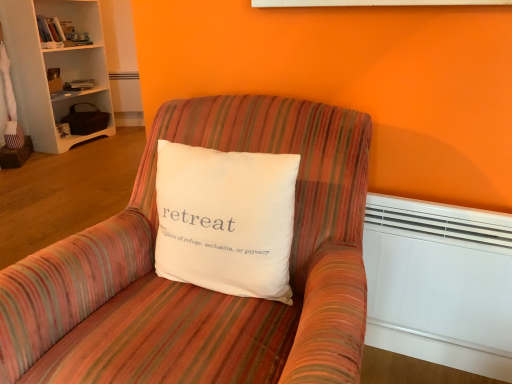
Identify the location of white cotton pillow at center. (226, 219).

Find the location of a particular element. striped fabric chair at center is located at coordinates (198, 287).

Locate an element on the screen. white cotton pillow at center is located at coordinates (226, 219).

From the image's perspective, would you say white cotton pillow at center is positioned over striped fabric chair at center?

Yes, from the image's perspective, white cotton pillow at center is over striped fabric chair at center.

Can you confirm if white cotton pillow at center is thinner than striped fabric chair at center?

Yes, white cotton pillow at center is thinner than striped fabric chair at center.

From the picture: Is striped fabric chair at center a part of white cotton pillow at center?

Actually, striped fabric chair at center is outside white cotton pillow at center.

Is white wood bookcase at upper left facing towards striped fabric chair at center?

No.

Considering the sizes of white wood bookcase at upper left and striped fabric chair at center in the image, is white wood bookcase at upper left bigger or smaller than striped fabric chair at center?

Considering their sizes, white wood bookcase at upper left takes up less space than striped fabric chair at center.

Is white wood bookcase at upper left beside striped fabric chair at center?

No, white wood bookcase at upper left is not with striped fabric chair at center.

From the image's perspective, which one is positioned higher, white wood bookcase at upper left or striped fabric chair at center?

white wood bookcase at upper left appears higher in the image.

From a real-world perspective, does white cotton pillow at center stand above white plastic heater at lower right?

Indeed, from a real-world perspective, white cotton pillow at center stands above white plastic heater at lower right.

From the picture: Is white cotton pillow at center at the left side of white plastic heater at lower right?

Indeed, white cotton pillow at center is positioned on the left side of white plastic heater at lower right.

From the image's perspective, is white cotton pillow at center over white plastic heater at lower right?

Yes, from the image's perspective, white cotton pillow at center is above white plastic heater at lower right.

Which object is thinner, striped fabric chair at center or white wood bookcase at upper left?

With smaller width is white wood bookcase at upper left.

Consider the image. Would you consider striped fabric chair at center to be distant from white wood bookcase at upper left?

Yes, striped fabric chair at center and white wood bookcase at upper left are quite far apart.

Does striped fabric chair at center have a larger size compared to white wood bookcase at upper left?

Indeed, striped fabric chair at center has a larger size compared to white wood bookcase at upper left.

Is striped fabric chair at center oriented towards white wood bookcase at upper left?

No, striped fabric chair at center does not turn towards white wood bookcase at upper left.

Between white plastic heater at lower right and striped fabric chair at center, which one has larger size?

With larger size is striped fabric chair at center.

Which of these two, white plastic heater at lower right or striped fabric chair at center, stands shorter?

white plastic heater at lower right is shorter.

From the image's perspective, relative to striped fabric chair at center, is white plastic heater at lower right above or below?

white plastic heater at lower right is situated higher than striped fabric chair at center in the image.

From a real-world perspective, is white plastic heater at lower right physically located above or below striped fabric chair at center?

white plastic heater at lower right is below striped fabric chair at center.

Are white cotton pillow at center and white wood bookcase at upper left beside each other?

No, white cotton pillow at center is not beside white wood bookcase at upper left.

Find the location of `pillow on the right of white wood bookcase at upper left`. pillow on the right of white wood bookcase at upper left is located at coordinates (226, 219).

Which object is further away from the camera taking this photo, white cotton pillow at center or white wood bookcase at upper left?

white wood bookcase at upper left.

From the image's perspective, is white cotton pillow at center above or below white wood bookcase at upper left?

From the image's perspective, white cotton pillow at center appears below white wood bookcase at upper left.

Considering the points (368, 240) and (167, 192), which point is behind, point (368, 240) or point (167, 192)?

Point (368, 240)

Can you confirm if white plastic heater at lower right is bigger than white cotton pillow at center?

No, white plastic heater at lower right is not bigger than white cotton pillow at center.

Is white plastic heater at lower right completely or partially outside of white cotton pillow at center?

Yes.

Who is taller, white plastic heater at lower right or white cotton pillow at center?

With more height is white plastic heater at lower right.

What are the coordinates of `chair to the left of white cotton pillow at center` in the screenshot? It's located at (198, 287).

In order to click on chair beneath the white wood bookcase at upper left (from a real-world perspective) in this screenshot , I will do `click(198, 287)`.

Estimate the real-world distances between objects in this image. Which object is closer to white plastic heater at lower right, striped fabric chair at center or white wood bookcase at upper left?

The object closer to white plastic heater at lower right is striped fabric chair at center.

Which object lies nearer to the anchor point white wood bookcase at upper left, white cotton pillow at center or white plastic heater at lower right?

white cotton pillow at center lies closer to white wood bookcase at upper left than the other object.

Looking at the image, which one is located closer to white wood bookcase at upper left, white plastic heater at lower right or striped fabric chair at center?

Among the two, striped fabric chair at center is located nearer to white wood bookcase at upper left.

From the image, which object appears to be farther from striped fabric chair at center, white cotton pillow at center or white plastic heater at lower right?

white plastic heater at lower right is positioned further to the anchor striped fabric chair at center.

When comparing their distances from white wood bookcase at upper left, does striped fabric chair at center or white plastic heater at lower right seem further?

white plastic heater at lower right is further to white wood bookcase at upper left.

Estimate the real-world distances between objects in this image. Which object is further from white cotton pillow at center, white plastic heater at lower right or white wood bookcase at upper left?

Among the two, white wood bookcase at upper left is located further to white cotton pillow at center.

In the scene shown: Considering their positions, is white wood bookcase at upper left positioned closer to white plastic heater at lower right than white cotton pillow at center?

The object closer to white plastic heater at lower right is white cotton pillow at center.

When comparing their distances from striped fabric chair at center, does white wood bookcase at upper left or white plastic heater at lower right seem further?

white wood bookcase at upper left is further to striped fabric chair at center.

Image resolution: width=512 pixels, height=384 pixels. Find the location of `heater positioned between striped fabric chair at center and white wood bookcase at upper left from near to far`. heater positioned between striped fabric chair at center and white wood bookcase at upper left from near to far is located at coordinates (440, 284).

The height and width of the screenshot is (384, 512). What are the coordinates of `heater positioned between white cotton pillow at center and white wood bookcase at upper left from near to far` in the screenshot? It's located at (440, 284).

Locate an element on the screen. The image size is (512, 384). pillow between striped fabric chair at center and white plastic heater at lower right is located at coordinates (226, 219).

At what (x,y) coordinates should I click in order to perform the action: click on pillow between striped fabric chair at center and white wood bookcase at upper left from front to back. Please return your answer as a coordinate pair (x, y). Image resolution: width=512 pixels, height=384 pixels. Looking at the image, I should click on (226, 219).